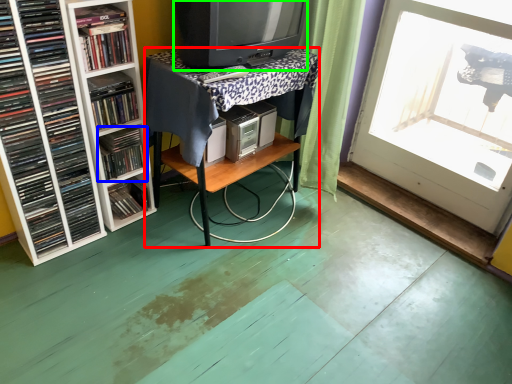
Question: Estimate the real-world distances between objects in this image. Which object is closer to table (highlighted by a red box), book (highlighted by a blue box) or television (highlighted by a green box)?

Choices:
 (A) book
 (B) television

Answer: (B)